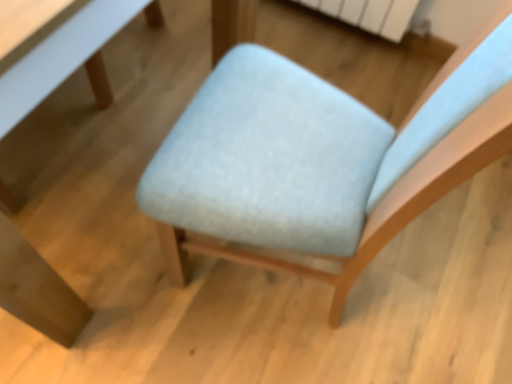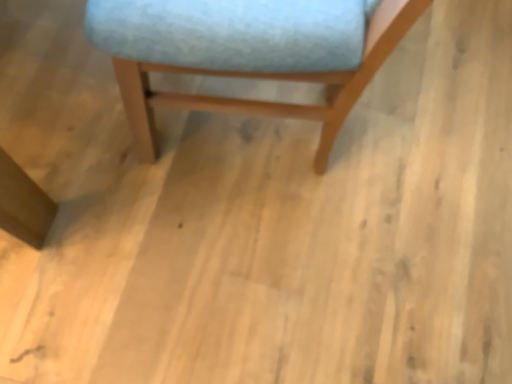
Question: Which way did the camera rotate in the video?

Choices:
 (A) rotated left
 (B) rotated right

Answer: (B)